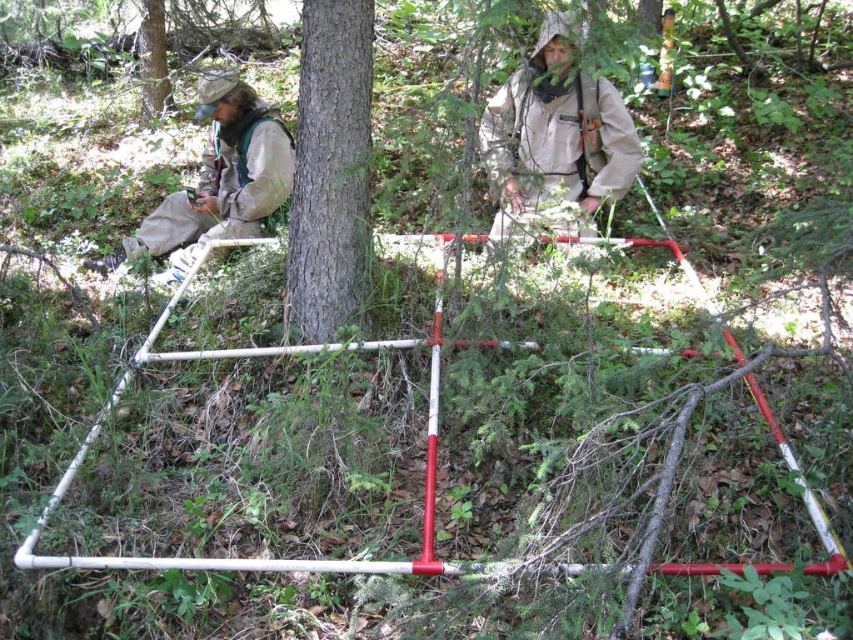
Question: Is khaki fabric jacket at left above smooth bark tree at upper left?

Choices:
 (A) yes
 (B) no

Answer: (B)

Question: Which of the following is the closest to the observer?

Choices:
 (A) smooth bark tree at upper left
 (B) smooth bark tree at center
 (C) khaki fabric jacket at left

Answer: (B)

Question: Which point appears closest to the camera in this image?

Choices:
 (A) (318, 116)
 (B) (149, 20)

Answer: (A)

Question: Can you confirm if smooth bark tree at center is positioned to the right of smooth bark tree at upper left?

Choices:
 (A) no
 (B) yes

Answer: (B)

Question: Does khaki fabric jacket at left come in front of smooth bark tree at upper left?

Choices:
 (A) no
 (B) yes

Answer: (B)

Question: Which point is closer to the camera taking this photo?

Choices:
 (A) (154, 83)
 (B) (212, 236)
 (C) (514, 218)
 (D) (297, 172)

Answer: (D)